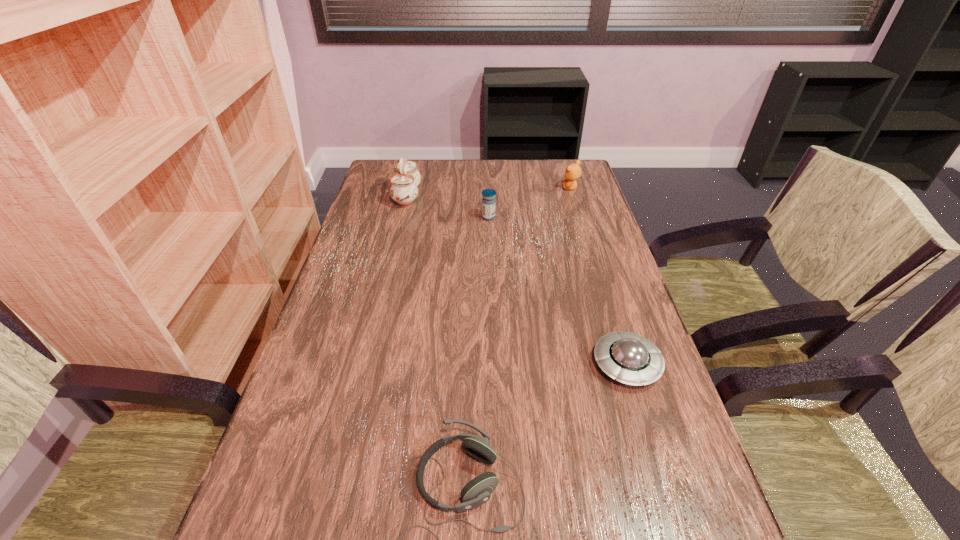
At what (x,y) coordinates should I click in order to perform the action: click on the leftmost object. Please return your answer as a coordinate pair (x, y). The height and width of the screenshot is (540, 960). Looking at the image, I should click on (404, 191).

Identify the location of the tallest object. (404, 191).

Where is `teddy bear`? This screenshot has width=960, height=540. teddy bear is located at coordinates (573, 171).

Find the location of a particular element. The height and width of the screenshot is (540, 960). the third farthest object is located at coordinates click(488, 201).

The image size is (960, 540). I want to click on the fourth farthest object, so click(x=631, y=359).

Find the location of `vacant area situated 0.050m by the handle of the chinaware`. vacant area situated 0.050m by the handle of the chinaware is located at coordinates (436, 196).

Find the location of a particular element. blank area located on the face of the teddy bear is located at coordinates (450, 188).

Find the location of `vacant space located on the face of the teddy bear`. vacant space located on the face of the teddy bear is located at coordinates (534, 188).

The width and height of the screenshot is (960, 540). I want to click on vacant position located 0.120m on the face of the teddy bear, so click(x=528, y=188).

This screenshot has height=540, width=960. I want to click on free space located on the front of the third farthest object, so click(490, 246).